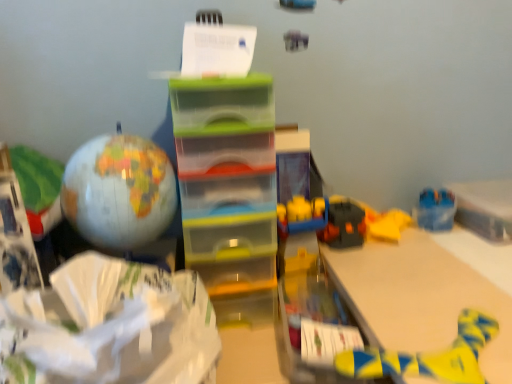
What are the coordinates of `matte globe at left` in the screenshot? It's located at (119, 191).

Image resolution: width=512 pixels, height=384 pixels. In order to click on yellow fabric toy at lower right in this screenshot , I will do `click(426, 355)`.

Is yellow fabric toy at lower right positioned with its back to white paper at upper center?

yellow fabric toy at lower right is not turned away from white paper at upper center.

This screenshot has height=384, width=512. What are the coordinates of `toy that is in front of the white paper at upper center` in the screenshot? It's located at click(x=426, y=355).

From a real-world perspective, is yellow fabric toy at lower right located beneath white paper at upper center?

Yes.

Is point (477, 353) closer to camera compared to point (234, 36)?

Yes, it is in front of point (234, 36).

Consider the image. Between yellow fabric toy at lower right and white matte wrapping paper at lower left, which one appears on the left side from the viewer's perspective?

Positioned to the left is white matte wrapping paper at lower left.

The image size is (512, 384). Identify the location of toy below the white matte wrapping paper at lower left (from the image's perspective). (426, 355).

In terms of width, does yellow fabric toy at lower right look wider or thinner when compared to white matte wrapping paper at lower left?

In the image, yellow fabric toy at lower right appears to be more narrow than white matte wrapping paper at lower left.

Is yellow fabric toy at lower right inside the boundaries of white matte wrapping paper at lower left, or outside?

yellow fabric toy at lower right lies outside white matte wrapping paper at lower left.

Which is behind, white paper at upper center or yellow fabric toy at lower right?

white paper at upper center is behind.

Considering the points (234, 34) and (386, 364), which point is in front, point (234, 34) or point (386, 364)?

Positioned in front is point (386, 364).

Which of these two, white paper at upper center or yellow fabric toy at lower right, is smaller?

Smaller between the two is yellow fabric toy at lower right.

From the image's perspective, is white paper at upper center on yellow fabric toy at lower right?

Yes.

Is matte globe at left completely or partially inside white paper at upper center?

That's incorrect, matte globe at left is not inside white paper at upper center.

Is white paper at upper center next to matte globe at left and touching it?

No, white paper at upper center is not with matte globe at left.

Does white paper at upper center lie in front of matte globe at left?

No.

From the image's perspective, is white paper at upper center positioned above or below matte globe at left?

Based on their image positions, white paper at upper center is located above matte globe at left.

Is white matte wrapping paper at lower left bigger or smaller than matte globe at left?

white matte wrapping paper at lower left is bigger than matte globe at left.

From a real-world perspective, is white matte wrapping paper at lower left above or below matte globe at left?

white matte wrapping paper at lower left is below matte globe at left.

Is white matte wrapping paper at lower left inside or outside of matte globe at left?

white matte wrapping paper at lower left is outside matte globe at left.

You are a GUI agent. You are given a task and a screenshot of the screen. Output one action in this format:
    pyautogui.click(x=<x>, y=<y>)
    Task: Click on the balloon to the left of white matte wrapping paper at lower left
    The image size is (512, 384).
    Given the screenshot: What is the action you would take?
    pyautogui.click(x=119, y=191)

Is white paper at upper center aimed at white matte wrapping paper at lower left?

No, white paper at upper center does not turn towards white matte wrapping paper at lower left.

From a real-world perspective, which is physically above, white paper at upper center or white matte wrapping paper at lower left?

white paper at upper center, from a real-world perspective.

Is white paper at upper center smaller than white matte wrapping paper at lower left?

Yes, white paper at upper center is smaller than white matte wrapping paper at lower left.

Is white paper at upper center surrounding white matte wrapping paper at lower left?

Actually, white matte wrapping paper at lower left is outside white paper at upper center.

Is point (348, 350) positioned before point (125, 162)?

That is True.

Is yellow fabric toy at lower right surrounding matte globe at left?

Actually, matte globe at left is outside yellow fabric toy at lower right.

Between yellow fabric toy at lower right and matte globe at left, which one has smaller width?

With smaller width is matte globe at left.

Where is `toy below the white paper at upper center (from a real-world perspective)`? Image resolution: width=512 pixels, height=384 pixels. toy below the white paper at upper center (from a real-world perspective) is located at coordinates (426, 355).

At what (x,y) coordinates should I click in order to perform the action: click on toy that appears in front of the white matte wrapping paper at lower left. Please return your answer as a coordinate pair (x, y). Looking at the image, I should click on (426, 355).

Considering their positions, is white matte wrapping paper at lower left positioned further to matte globe at left than yellow fabric toy at lower right?

Based on the image, yellow fabric toy at lower right appears to be further to matte globe at left.

Based on their spatial positions, is matte globe at left or white matte wrapping paper at lower left closer to yellow fabric toy at lower right?

white matte wrapping paper at lower left lies closer to yellow fabric toy at lower right than the other object.

Based on their spatial positions, is yellow fabric toy at lower right or white matte wrapping paper at lower left closer to matte globe at left?

white matte wrapping paper at lower left.

Which object lies nearer to the anchor point white matte wrapping paper at lower left, yellow fabric toy at lower right or matte globe at left?

matte globe at left is closer to white matte wrapping paper at lower left.

Considering their positions, is yellow fabric toy at lower right positioned closer to white paper at upper center than white matte wrapping paper at lower left?

Among the two, white matte wrapping paper at lower left is located nearer to white paper at upper center.

In the scene shown: Which object lies nearer to the anchor point white paper at upper center, matte globe at left or white matte wrapping paper at lower left?

matte globe at left is positioned closer to the anchor white paper at upper center.

Looking at the image, which one is located closer to yellow fabric toy at lower right, white paper at upper center or white matte wrapping paper at lower left?

Based on the image, white matte wrapping paper at lower left appears to be nearer to yellow fabric toy at lower right.

Based on their spatial positions, is yellow fabric toy at lower right or white paper at upper center closer to white matte wrapping paper at lower left?

yellow fabric toy at lower right lies closer to white matte wrapping paper at lower left than the other object.

The image size is (512, 384). In order to click on wrapping paper situated between matte globe at left and yellow fabric toy at lower right from left to right in this screenshot , I will do `click(113, 326)`.

Find the location of a particular element. This screenshot has height=384, width=512. writing situated between matte globe at left and yellow fabric toy at lower right from left to right is located at coordinates (217, 49).

Where is `balloon between white paper at upper center and white matte wrapping paper at lower left vertically`? The width and height of the screenshot is (512, 384). balloon between white paper at upper center and white matte wrapping paper at lower left vertically is located at coordinates (119, 191).

In order to click on wrapping paper between white paper at upper center and yellow fabric toy at lower right in the vertical direction in this screenshot , I will do `click(113, 326)`.